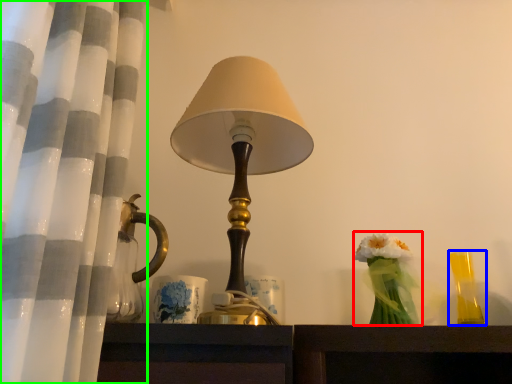
Question: Considering the real-world distances, which object is farthest from floral arrangement (highlighted by a red box)? candle holder (highlighted by a blue box) or curtain (highlighted by a green box)?

Choices:
 (A) candle holder
 (B) curtain

Answer: (B)